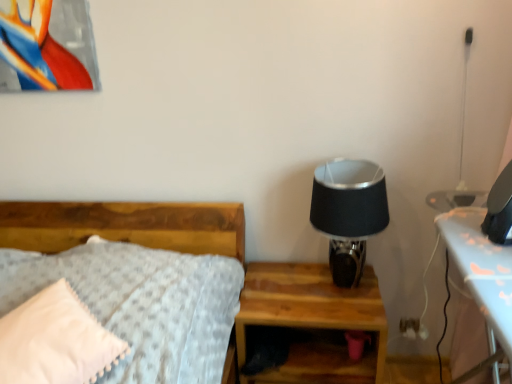
Question: In the image, is black fabric lampshade at upper right on the left side or the right side of metallic silver picture frame at upper left?

Choices:
 (A) left
 (B) right

Answer: (B)

Question: Choose the correct answer: Is black fabric lampshade at upper right inside metallic silver picture frame at upper left or outside it?

Choices:
 (A) inside
 (B) outside

Answer: (B)

Question: Based on their relative distances, which object is farther from the white soft pillow at left?

Choices:
 (A) wooden nightstand at lower right
 (B) white plastic electric outlet at lower right
 (C) black fabric lampshade at upper right
 (D) metallic silver picture frame at upper left

Answer: (B)

Question: Estimate the real-world distances between objects in this image. Which object is closer to the wooden nightstand at lower right?

Choices:
 (A) black fabric lampshade at upper right
 (B) white soft pillow at left
 (C) metallic silver picture frame at upper left
 (D) white plastic electric outlet at lower right

Answer: (A)